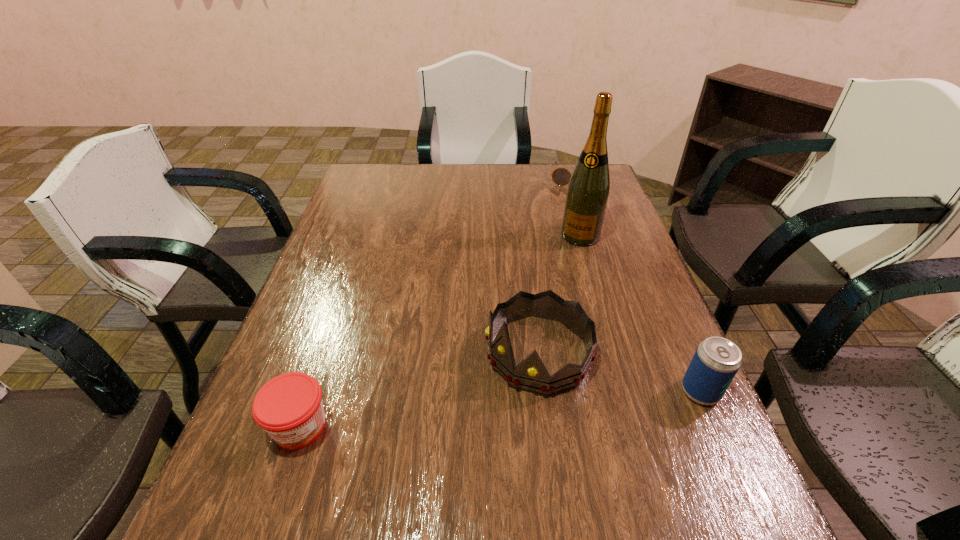
Identify the location of vacant area situated 0.080m on the front-facing side of the wine bottle. (568, 262).

Where is `vacant space positioned on the front-facing side of the wine bottle`? The width and height of the screenshot is (960, 540). vacant space positioned on the front-facing side of the wine bottle is located at coordinates (558, 286).

This screenshot has width=960, height=540. Identify the location of free spot located on the lenses of the sunglasses. (564, 212).

Identify the location of free space located 0.110m on the lenses of the sunglasses. (566, 206).

Locate an element on the screen. Image resolution: width=960 pixels, height=540 pixels. blank space located 0.200m on the lenses of the sunglasses is located at coordinates (563, 221).

The height and width of the screenshot is (540, 960). Find the location of `vacant space situated 0.110m at the front of the tiara with jewels`. vacant space situated 0.110m at the front of the tiara with jewels is located at coordinates click(x=456, y=409).

In order to click on vacant region located 0.150m at the front of the tiara with jewels in this screenshot , I will do `click(439, 420)`.

Where is `vacant space positioned at the front of the tiara with jewels`? This screenshot has width=960, height=540. vacant space positioned at the front of the tiara with jewels is located at coordinates (390, 454).

Where is `object located at the far edge`? The image size is (960, 540). object located at the far edge is located at coordinates pyautogui.click(x=561, y=176).

Where is `object that is at the near edge`? The image size is (960, 540). object that is at the near edge is located at coordinates (289, 407).